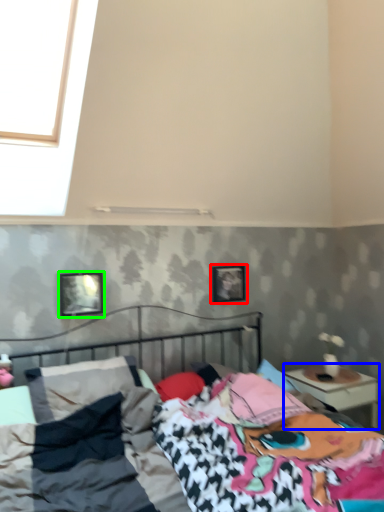
Question: Considering the real-world distances, which object is farthest from picture frame (highlighted by a red box)? nightstand (highlighted by a blue box) or picture frame (highlighted by a green box)?

Choices:
 (A) nightstand
 (B) picture frame

Answer: (B)